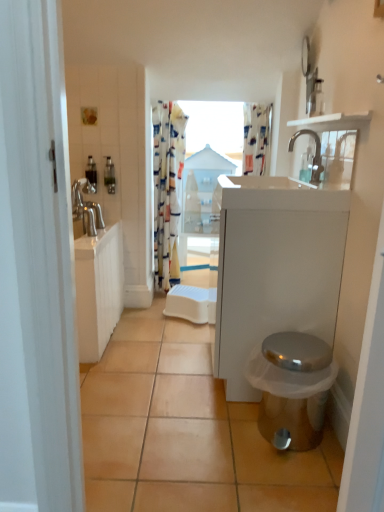
Find the location of a particular element. This screenshot has width=384, height=512. vacant region above floral fabric curtain at center (from a real-world perspective) is located at coordinates (179, 99).